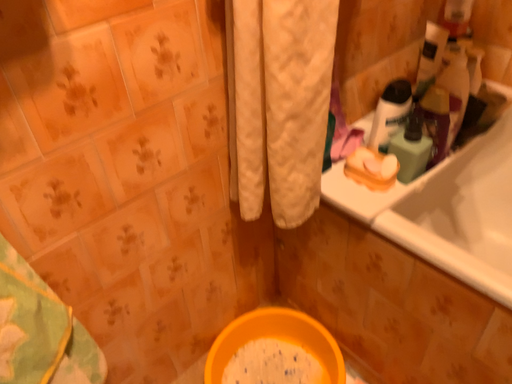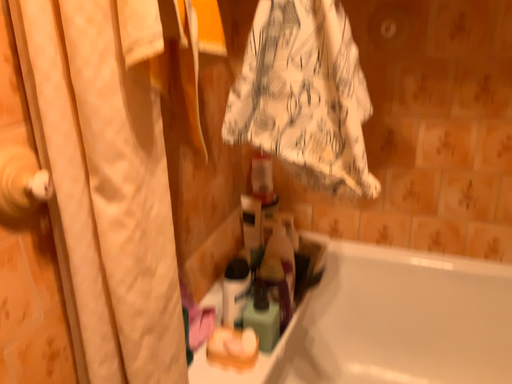
Question: How did the camera likely rotate when shooting the video?

Choices:
 (A) rotated left
 (B) rotated right

Answer: (B)